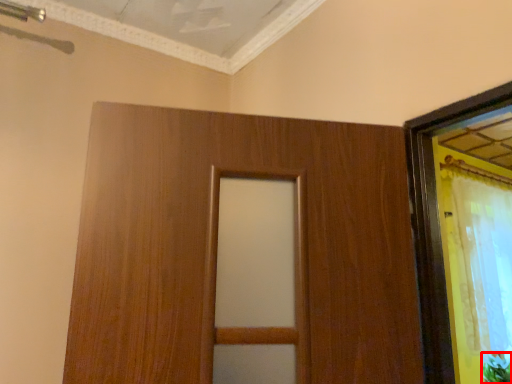
Question: From the image's perspective, where is plant (annotated by the red box) located in relation to curtain in the image?

Choices:
 (A) below
 (B) above

Answer: (A)